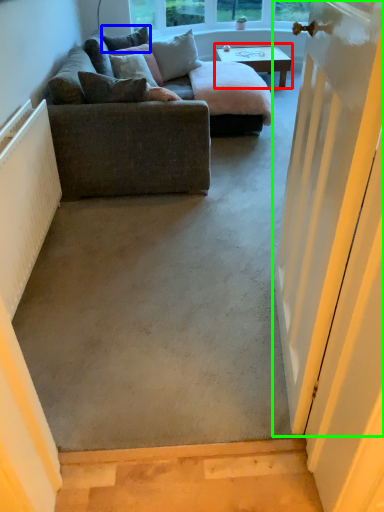
Question: Which is nearer to the coffee table (highlighted by a red box)? pillow (highlighted by a blue box) or door (highlighted by a green box).

Choices:
 (A) pillow
 (B) door

Answer: (A)